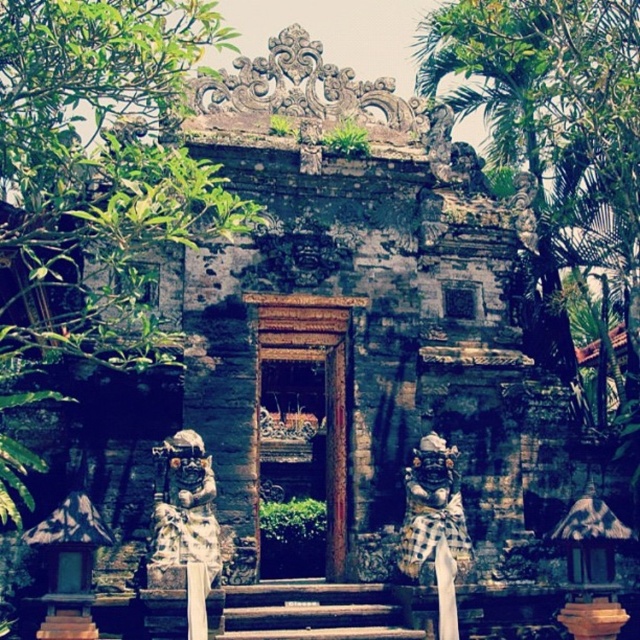
Question: Based on their relative distances, which object is farther from the carved stone statue at center?

Choices:
 (A) wooden stairs at center
 (B) wooden door at center

Answer: (A)

Question: Can you confirm if wooden door at center is smaller than wooden stairs at center?

Choices:
 (A) yes
 (B) no

Answer: (B)

Question: Among these objects, which one is nearest to the camera?

Choices:
 (A) wooden door at center
 (B) carved stone statue at center
 (C) wooden stairs at center

Answer: (C)

Question: Is wooden door at center wider than wooden stairs at center?

Choices:
 (A) no
 (B) yes

Answer: (A)

Question: Is wooden door at center smaller than carved stone statue at center?

Choices:
 (A) yes
 (B) no

Answer: (B)

Question: Which is farther from the wooden stairs at center?

Choices:
 (A) wooden door at center
 (B) carved stone statue at center

Answer: (B)